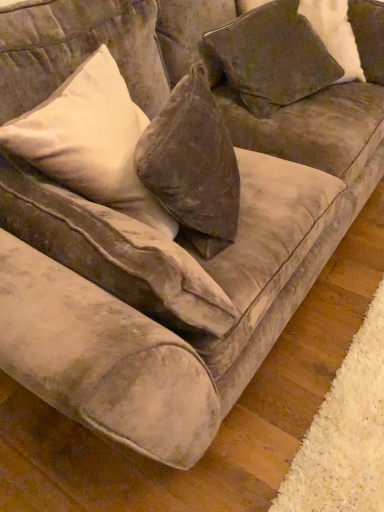
Question: Considering the positions of velvet beige pillow at upper left, acting as the second pillow starting from the right, and velvet brown pillow at upper right, arranged as the second pillow when viewed from the left, in the image, is velvet beige pillow at upper left, acting as the second pillow starting from the right, bigger or smaller than velvet brown pillow at upper right, arranged as the second pillow when viewed from the left,?

Choices:
 (A) small
 (B) big

Answer: (B)

Question: Is point (21, 116) positioned closer to the camera than point (273, 10)?

Choices:
 (A) farther
 (B) closer

Answer: (B)

Question: Visually, is velvet beige pillow at upper left, acting as the first pillow starting from the left, positioned to the left or to the right of velvet brown pillow at upper right, placed as the 1th pillow when sorted from right to left?

Choices:
 (A) left
 (B) right

Answer: (A)

Question: Looking at the image, does velvet brown pillow at upper right, placed as the 1th pillow when sorted from right to left, seem bigger or smaller compared to velvet beige pillow at upper left, acting as the first pillow starting from the left?

Choices:
 (A) big
 (B) small

Answer: (B)

Question: From a real-world perspective, is velvet brown pillow at upper right, arranged as the second pillow when viewed from the left, positioned above or below velvet beige pillow at upper left, acting as the first pillow starting from the left?

Choices:
 (A) below
 (B) above

Answer: (A)

Question: Is point (284, 24) positioned closer to the camera than point (139, 194)?

Choices:
 (A) closer
 (B) farther

Answer: (B)

Question: Is velvet brown pillow at upper right, placed as the 1th pillow when sorted from right to left, to the left or to the right of velvet beige pillow at upper left, acting as the second pillow starting from the right, in the image?

Choices:
 (A) left
 (B) right

Answer: (B)